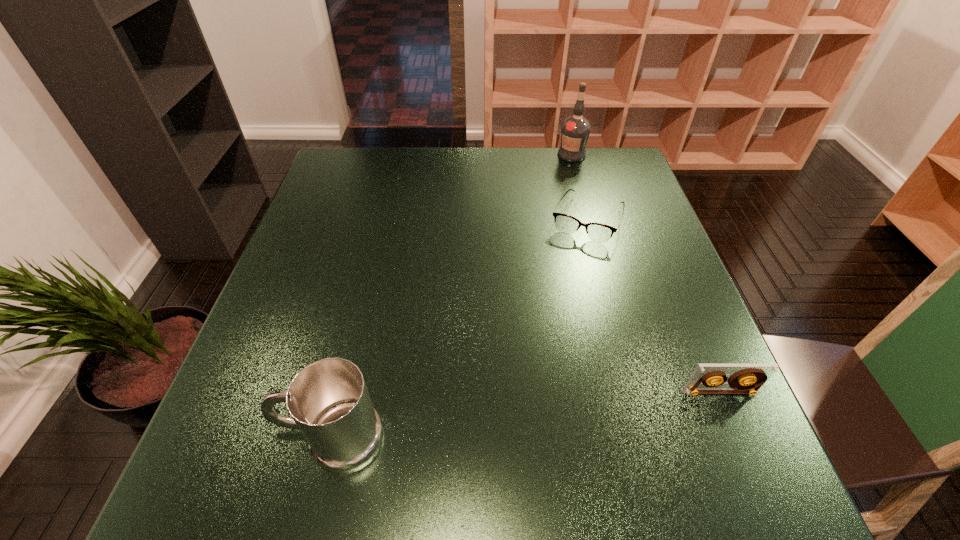
Where is `blank space located 0.320m on the face of the shortest object`? blank space located 0.320m on the face of the shortest object is located at coordinates (535, 340).

At what (x,y) coordinates should I click in order to perform the action: click on free space located on the face of the shortest object. Please return your answer as a coordinate pair (x, y). Looking at the image, I should click on (567, 264).

Where is `vacant space situated on the face of the shortest object`? The width and height of the screenshot is (960, 540). vacant space situated on the face of the shortest object is located at coordinates (528, 355).

Where is `blank space located on the front label of the farthest object`? This screenshot has height=540, width=960. blank space located on the front label of the farthest object is located at coordinates (572, 175).

At what (x,y) coordinates should I click in order to perform the action: click on free location located on the front label of the farthest object. Please return your answer as a coordinate pair (x, y). Looking at the image, I should click on (573, 195).

Locate an element on the screen. This screenshot has height=540, width=960. free location located on the front label of the farthest object is located at coordinates (576, 237).

The image size is (960, 540). Find the location of `object situated at the far edge`. object situated at the far edge is located at coordinates pyautogui.click(x=575, y=130).

Where is `mug at the near edge`? This screenshot has width=960, height=540. mug at the near edge is located at coordinates (328, 400).

Where is `videotape located at the near edge`? videotape located at the near edge is located at coordinates (746, 378).

Where is `object at the left edge`? object at the left edge is located at coordinates (328, 400).